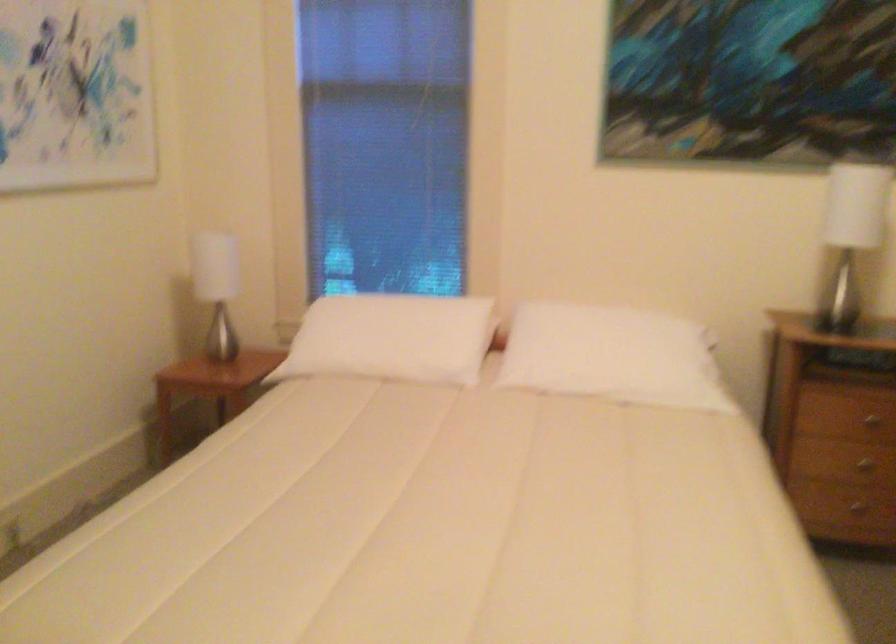
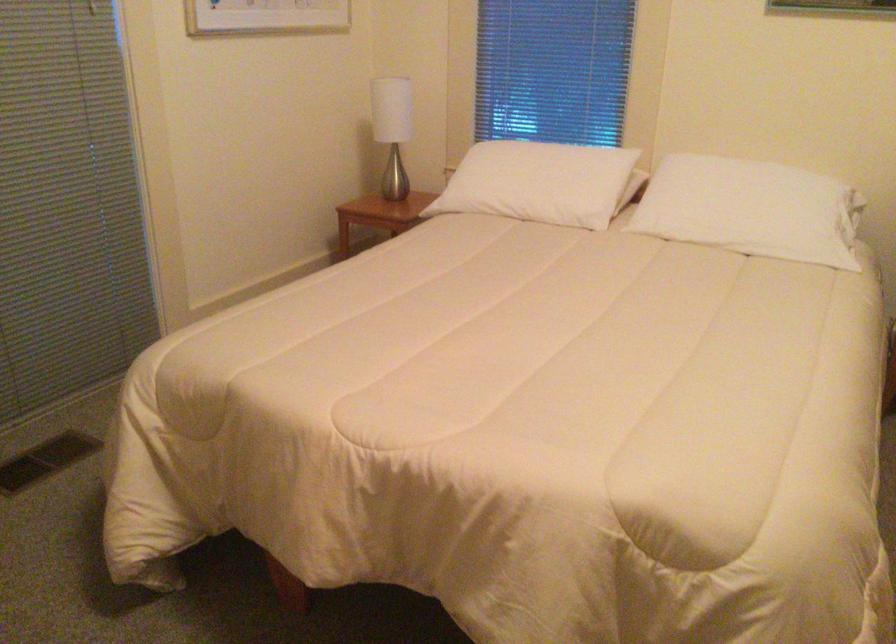
Find the pixel in the second image that matches (626,364) in the first image.

(752, 210)